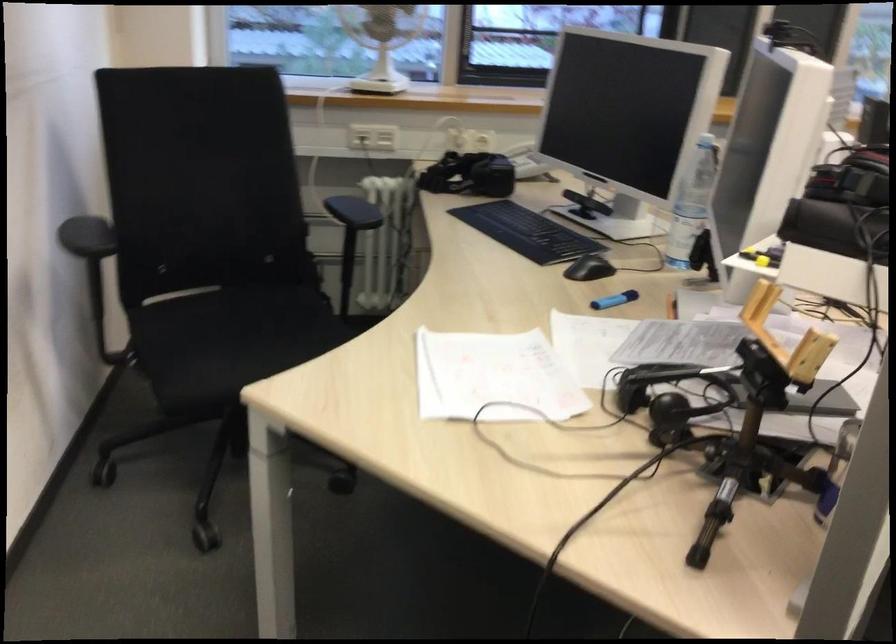
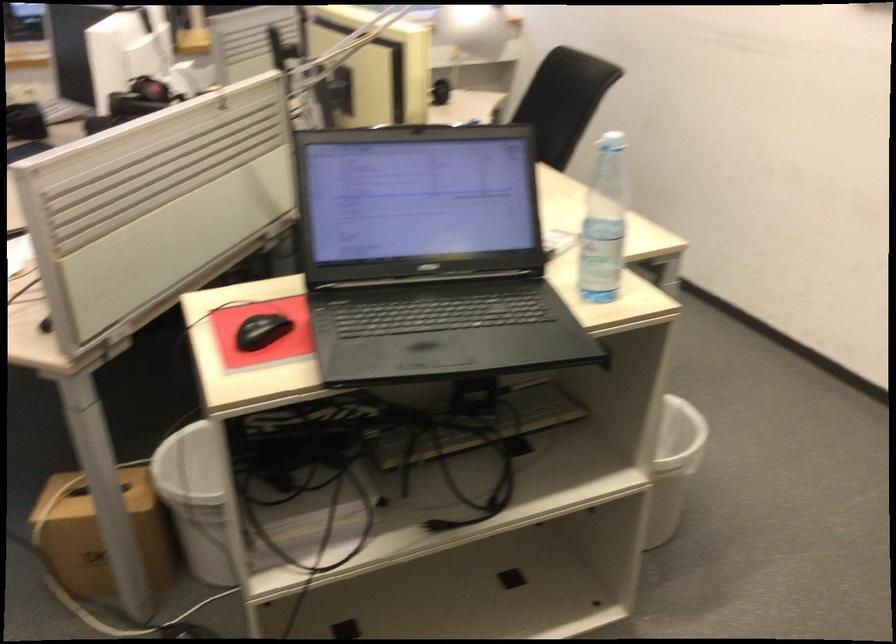
Question: I am providing you with two images of the same scene from different viewpoints. Please identify which objects are invisible in image2.

Choices:
 (A) telephone handset
 (B) white bottle cap
 (C) white trash can
 (D) white fabric curtain

Answer: (A)